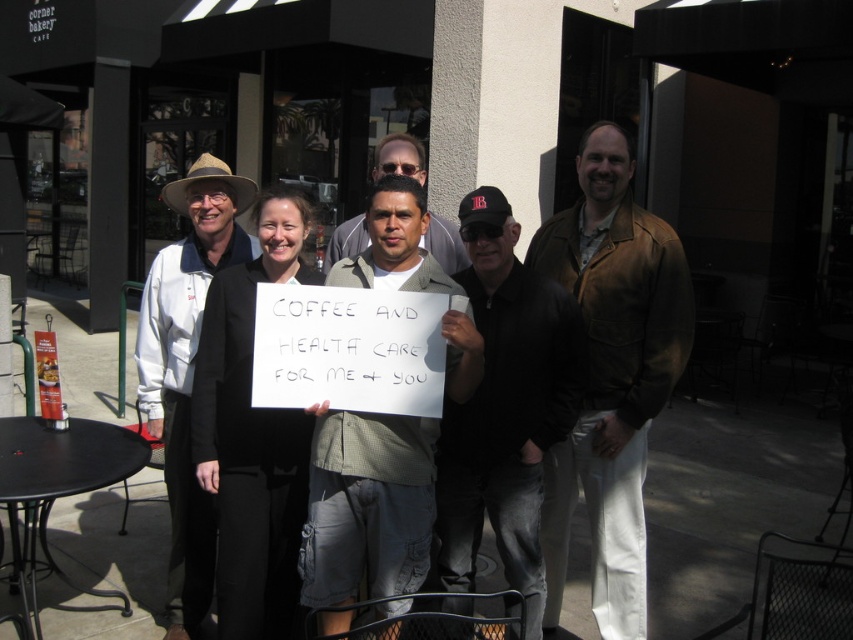
You are a photographer standing 1.5 meters away from the group. You want to take a photo that includes both the black fabric sign at center and the light brown textured shirt at center without any part of them being cut off. What is the minimum width of the camera lens you should use?

The black fabric sign at center and light brown textured shirt at center are 82.20 centimeters apart from each other. To capture both in the frame without cropping, the camera lens should have a minimum width of at least 82.20 centimeters.

You are a photographer trying to capture a clear shot of both the matte white coat at left and the light brown textured shirt at center. Since you want to ensure both are visible in the frame, which object should you focus on first to account for their sizes?

The matte white coat at left is larger than the light brown textured shirt at center, so you should focus on the matte white coat at left first to ensure its details are sharp before adjusting for the smaller one.

You are a photographer setting up for a group photo. You notice the matte white coat at left and the light brown textured shirt at center. Which clothing item appears narrower in the photo?

The matte white coat at left appears narrower than the light brown textured shirt at center.